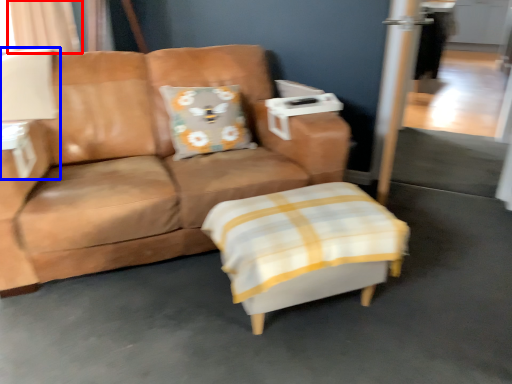
Question: Which object is further to the camera taking this photo, curtain (highlighted by a red box) or table lamp (highlighted by a blue box)?

Choices:
 (A) curtain
 (B) table lamp

Answer: (A)